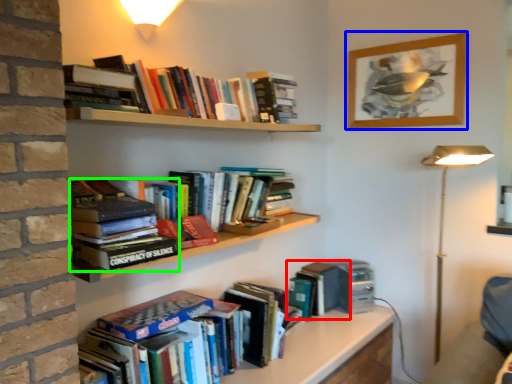
Question: Which object is positioned closest to book (highlighted by a red box)? Select from picture frame (highlighted by a blue box) and book (highlighted by a green box).

Choices:
 (A) picture frame
 (B) book

Answer: (A)